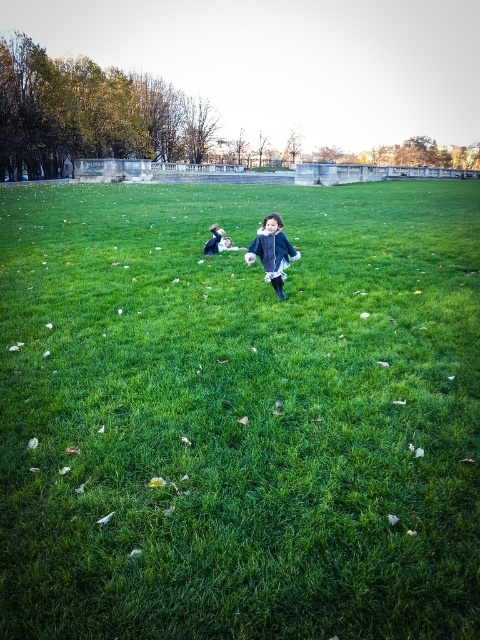
Question: Is green grass at center thinner than matte blue coat at center?

Choices:
 (A) yes
 (B) no

Answer: (B)

Question: Which point appears farthest from the camera in this image?

Choices:
 (A) (210, 241)
 (B) (92, 276)

Answer: (A)

Question: Where is green grass at center located in relation to matte black jacket at center in the image?

Choices:
 (A) above
 (B) below

Answer: (B)

Question: Is matte blue coat at center bigger than matte black jacket at center?

Choices:
 (A) yes
 (B) no

Answer: (A)

Question: Which object is farther from the camera taking this photo?

Choices:
 (A) matte black jacket at center
 (B) matte blue coat at center
 (C) green grass at center

Answer: (A)

Question: Among these objects, which one is nearest to the camera?

Choices:
 (A) matte black jacket at center
 (B) green grass at center

Answer: (B)